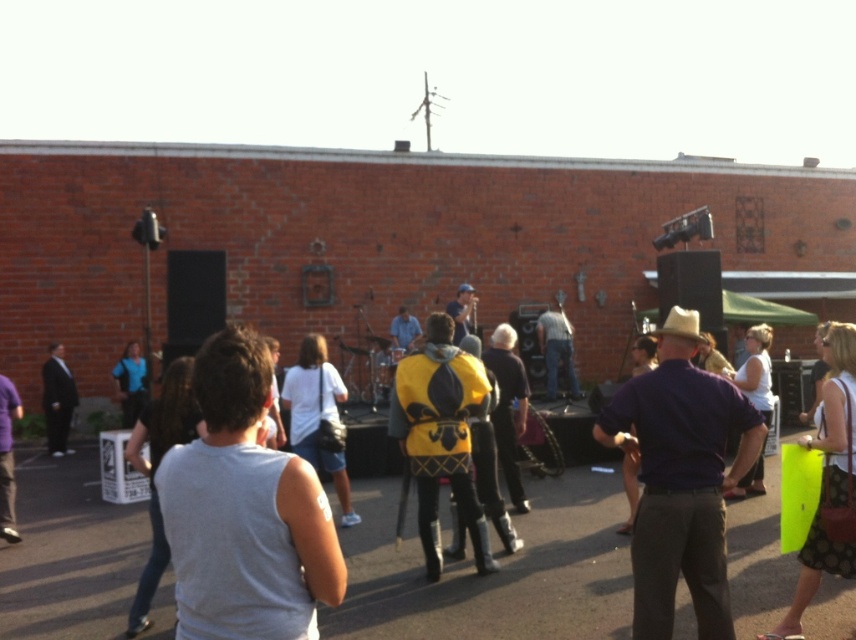
You are standing at the origin point of the coordinate system in the image. The image has a coordinate system where the bottom left corner is the origin. You want to locate the purple cotton shirt at center. What are its coordinates?

The purple cotton shirt at center is located at coordinates point (681, 477).

You are organizing a small outdoor event and need to ensure that all participants are within a 10 feet safety zone. Given the distance between the white fabric shirt at center and the gray sleeveless shirt at lower left, can both individuals remain in their current positions without violating the safety guidelines?

The distance between the white fabric shirt at center and the gray sleeveless shirt at lower left is 8.35 feet, which is within the 10 feet safety zone requirement. Therefore, both individuals can stay in their current positions without violating the safety guidelines.